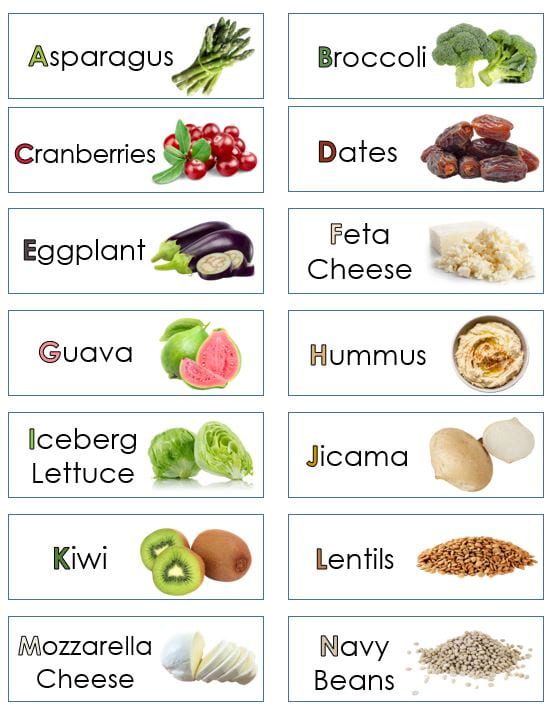
Where is `bowl`? The width and height of the screenshot is (559, 713). bowl is located at coordinates (498, 321).